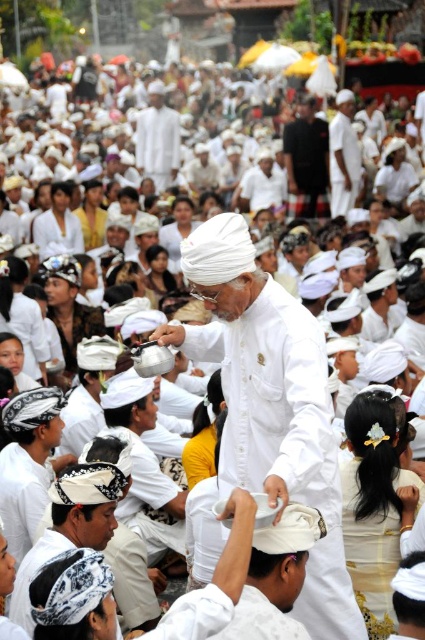
You are an anthropologist observing this cultural ceremony. You notice the white matte shirt at center and the white cotton turban at center. Which object is taller in this scene?

The white cotton turban at center is taller than the white matte shirt at center.

You are a photographer standing at the edge of the crowd. You want to take a photo that includes both the white matte shirt at center and the white cotton turban at center. Given that your camera has a maximum focus range of 70 meters, will you be able to capture both objects in focus at the same time?

The white matte shirt at center is 75.41 meters away from the white cotton turban at center. Since the distance between them exceeds the camera maximum focus range of 70 meters, you won t be able to capture both in focus simultaneously.